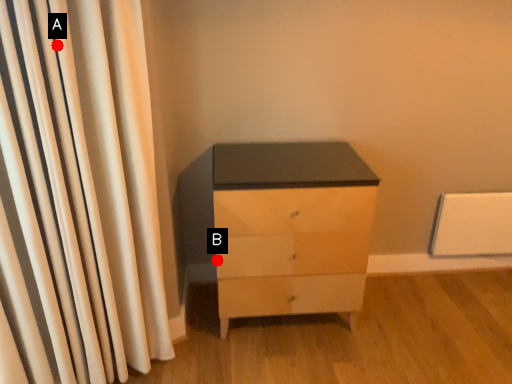
Question: Two points are circled on the image, labeled by A and B beside each circle. Which point is closer to the camera?

Choices:
 (A) A is closer
 (B) B is closer

Answer: (A)